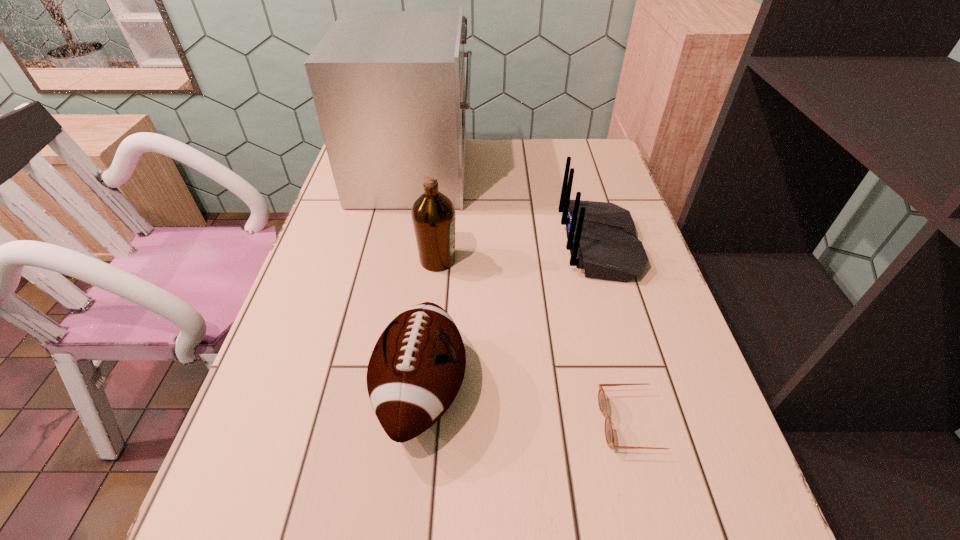
In the image, there is a desktop. At what (x,y) coordinates should I click in order to perform the action: click on free region at the far edge. Please return your answer as a coordinate pair (x, y). Looking at the image, I should click on (504, 168).

Find the location of a particular element. Image resolution: width=960 pixels, height=540 pixels. vacant region at the left edge of the desktop is located at coordinates (306, 269).

I want to click on vacant position at the right edge of the desktop, so click(629, 427).

Find the location of `vacant point at the far right corner`. vacant point at the far right corner is located at coordinates (588, 159).

You are a GUI agent. You are given a task and a screenshot of the screen. Output one action in this format:
    pyautogui.click(x=<x>, y=<y>)
    Task: Click on the free space at the near right corner of the desktop
    
    Given the screenshot: What is the action you would take?
    pyautogui.click(x=732, y=532)

Locate an element on the screen. This screenshot has width=960, height=540. free space that is in between the football (American) and the router is located at coordinates (511, 318).

The height and width of the screenshot is (540, 960). Find the location of `free space between the sunglasses and the farthest object`. free space between the sunglasses and the farthest object is located at coordinates (525, 297).

Locate an element on the screen. The height and width of the screenshot is (540, 960). free point between the router and the football (American) is located at coordinates (511, 318).

Find the location of a particular element. vacant space that's between the farthest object and the shortest object is located at coordinates (525, 297).

This screenshot has width=960, height=540. I want to click on free space between the olive oil and the router, so click(x=518, y=252).